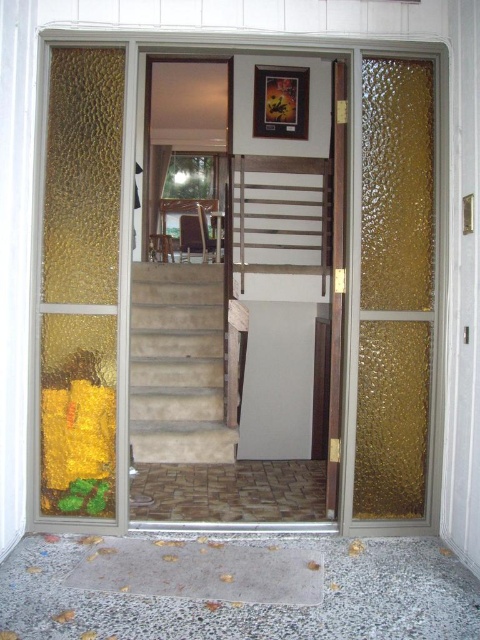
You are moving a large sofa into the house through the entrance. The sofa is 1.8 meters wide. Can the gold textured glass door at right and the wooden at center accommodate the sofa? Please explain based on their sizes.

The gold textured glass door at right occupies less space than wooden at center. Since the sofa is 1.8 meters wide, it might not fit through the gold textured glass door at right due to its smaller size, but the wooden at center, which is larger, could potentially accommodate the sofa.

You are a delivery person trying to enter the house through the transparent glass door at center. The stairs are in your way. Which direction should you move to reach the door without stepping on the beige carpeted stairs at center?

The transparent glass door at center is on the right side of the beige carpeted stairs at center, so you should move to the right of the stairs to reach the door without stepping on them.

You are standing outside the glass door shown in the image. You notice a point marked at coordinates [240,285]. Based on the scene description, what object does this point most likely correspond to?

The point at [240,285] corresponds to the transparent glass door at center, as indicated by the Objects Description.